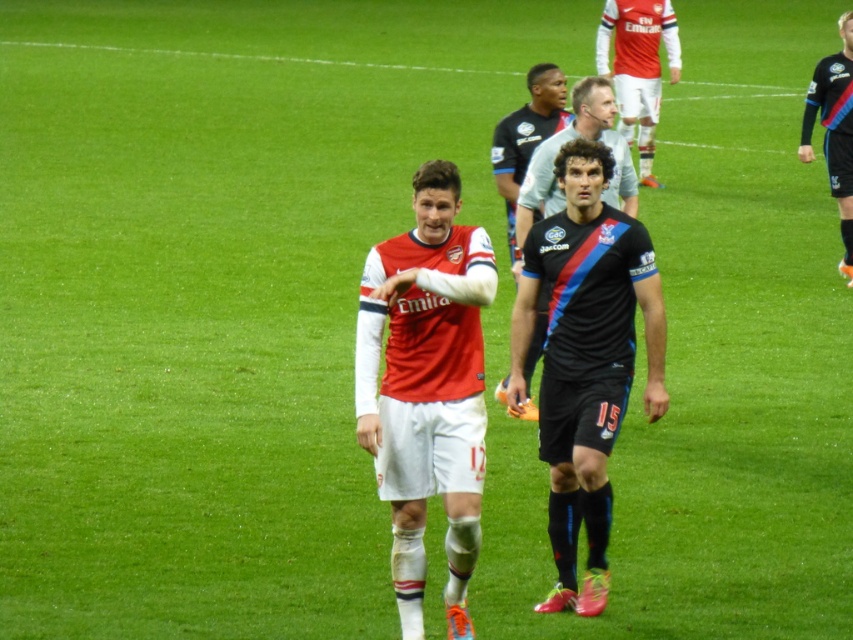
Question: Based on their relative distances, which object is nearer to the matte jersey at upper center?

Choices:
 (A) matte red jersey at center
 (B) black jersey at center

Answer: (B)

Question: Is the position of matte red jersey at center less distant than that of black jersey at center?

Choices:
 (A) yes
 (B) no

Answer: (A)

Question: Which point is closer to the camera?

Choices:
 (A) matte jersey at upper center
 (B) black jersey at center
 (C) matte red jersey at center

Answer: (C)

Question: Does matte jersey at upper center have a smaller size compared to black jersey at center?

Choices:
 (A) no
 (B) yes

Answer: (A)

Question: Considering the relative positions of black matte jersey at center and matte jersey at upper center in the image provided, where is black matte jersey at center located with respect to matte jersey at upper center?

Choices:
 (A) below
 (B) above

Answer: (A)

Question: Which object appears farthest from the camera in this image?

Choices:
 (A) black matte jersey at center
 (B) matte jersey at upper center
 (C) black jersey at center
 (D) matte red jersey at center

Answer: (B)